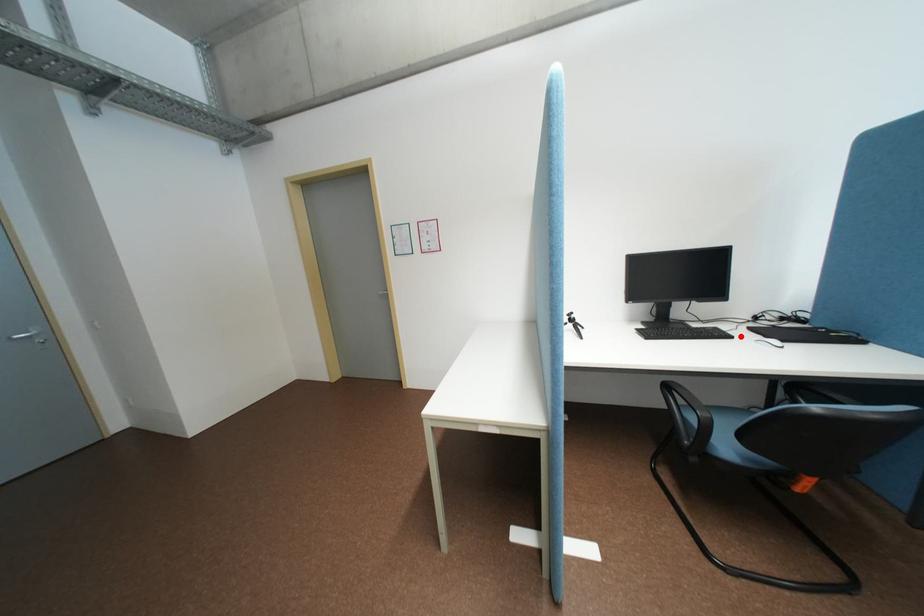
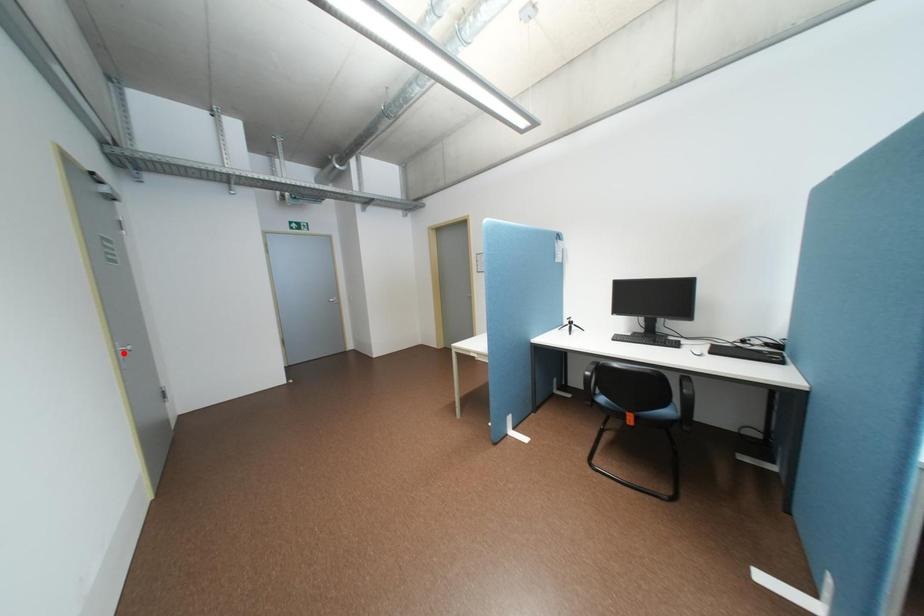
I am providing you with two images of the same scene from different viewpoints. A red point is marked on the first image and another point is marked on the second image. Does the point marked in image1 correspond to the same location as the one in image2?

No